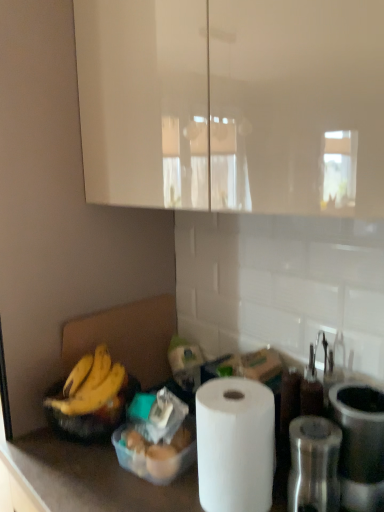
Question: Is the depth of yellow matte bananas at lower left greater than that of translucent plastic container at lower center?

Choices:
 (A) yes
 (B) no

Answer: (A)

Question: Does yellow matte bananas at lower left have a lesser height compared to translucent plastic container at lower center?

Choices:
 (A) yes
 (B) no

Answer: (A)

Question: Is yellow matte bananas at lower left smaller than translucent plastic container at lower center?

Choices:
 (A) yes
 (B) no

Answer: (A)

Question: Does yellow matte bananas at lower left appear on the left side of translucent plastic container at lower center?

Choices:
 (A) no
 (B) yes

Answer: (B)

Question: From the image's perspective, is yellow matte bananas at lower left on top of translucent plastic container at lower center?

Choices:
 (A) yes
 (B) no

Answer: (A)

Question: Is yellow matte bananas at lower left not inside translucent plastic container at lower center?

Choices:
 (A) no
 (B) yes

Answer: (B)

Question: Is metallic silver grinder at right, which is the second appliance from right to left, oriented towards metallic silver canister at right, which ranks as the 1th appliance in right-to-left order?

Choices:
 (A) yes
 (B) no

Answer: (B)

Question: Is metallic silver grinder at right, placed as the 1th appliance when sorted from left to right, bigger than metallic silver canister at right, the second appliance when ordered from left to right?

Choices:
 (A) yes
 (B) no

Answer: (B)

Question: Is metallic silver grinder at right, which is the second appliance from right to left, further to the viewer compared to metallic silver canister at right, the second appliance when ordered from left to right?

Choices:
 (A) yes
 (B) no

Answer: (B)

Question: From a real-world perspective, is metallic silver grinder at right, which is the second appliance from right to left, physically above metallic silver canister at right, which ranks as the 1th appliance in right-to-left order?

Choices:
 (A) no
 (B) yes

Answer: (A)

Question: Does metallic silver grinder at right, placed as the 1th appliance when sorted from left to right, have a smaller size compared to metallic silver canister at right, the second appliance when ordered from left to right?

Choices:
 (A) yes
 (B) no

Answer: (A)

Question: Does metallic silver grinder at right, which is the second appliance from right to left, have a greater width compared to metallic silver canister at right, which ranks as the 1th appliance in right-to-left order?

Choices:
 (A) yes
 (B) no

Answer: (B)

Question: Is translucent plastic container at lower center far from yellow matte bananas at lower left?

Choices:
 (A) yes
 (B) no

Answer: (B)